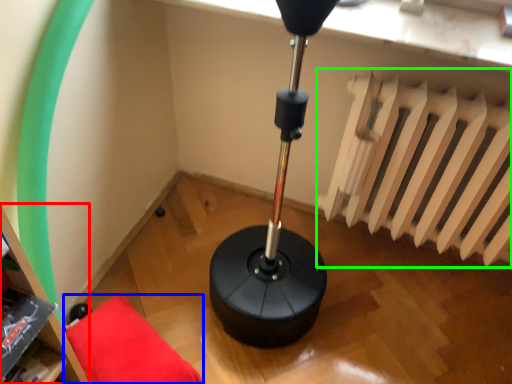
Question: Which is nearer to the bookshelf (highlighted by a red box)? furniture (highlighted by a blue box) or radiator (highlighted by a green box).

Choices:
 (A) furniture
 (B) radiator

Answer: (A)